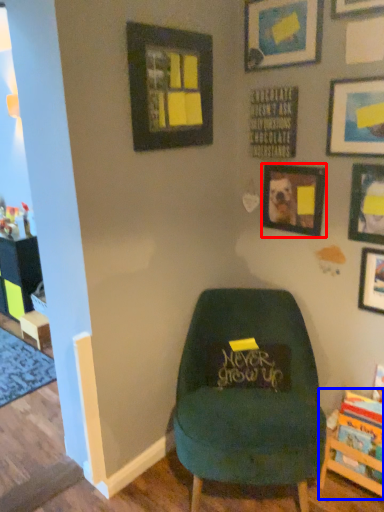
Question: Which object is further to the camera taking this photo, picture frame (highlighted by a red box) or shelf (highlighted by a blue box)?

Choices:
 (A) picture frame
 (B) shelf

Answer: (A)